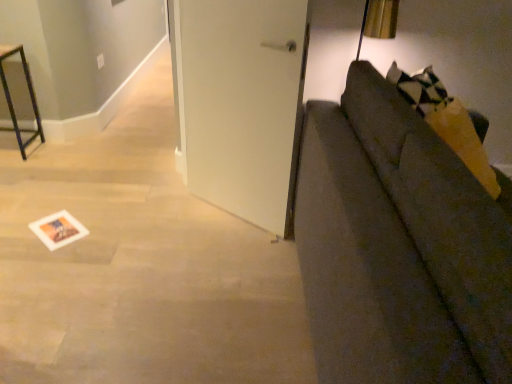
The height and width of the screenshot is (384, 512). I want to click on vacant space underneath white matte door at center (from a real-world perspective), so click(x=233, y=216).